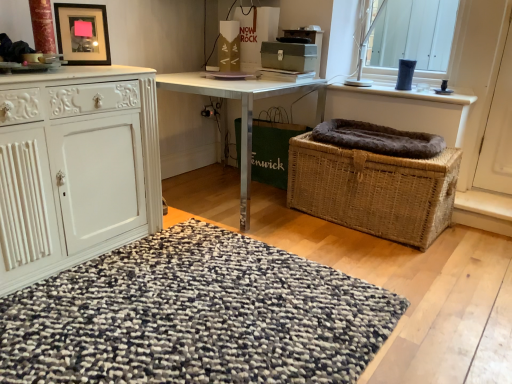
Question: Is matte black picture frame at upper left situated inside textured woolen rug at center or outside?

Choices:
 (A) outside
 (B) inside

Answer: (A)

Question: From a real-world perspective, is matte black picture frame at upper left positioned above or below textured woolen rug at center?

Choices:
 (A) below
 (B) above

Answer: (B)

Question: Which is farther from the matte black picture frame at upper left?

Choices:
 (A) textured woolen rug at center
 (B) white carved cabinet at left
 (C) metallic silver desk at center
 (D) woven brown basket at center
 (E) woven brown picnic basket at lower right

Answer: (E)

Question: Which is farther from the textured woolen rug at center?

Choices:
 (A) woven brown basket at center
 (B) white carved cabinet at left
 (C) woven brown picnic basket at lower right
 (D) metallic silver desk at center
 (E) matte black picture frame at upper left

Answer: (A)